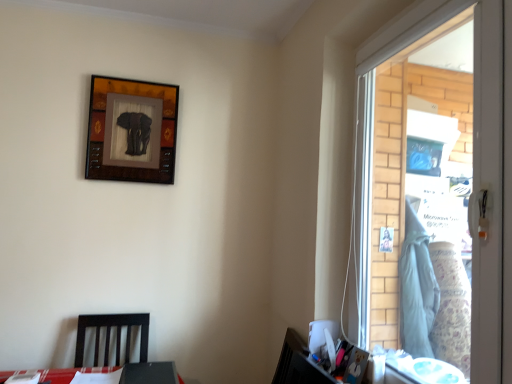
Question: Is dark wood chair at lower left wider than wooden elephant art at upper left?

Choices:
 (A) no
 (B) yes

Answer: (B)

Question: Is dark wood chair at lower left aimed at wooden elephant art at upper left?

Choices:
 (A) yes
 (B) no

Answer: (B)

Question: From the image's perspective, is dark wood chair at lower left on top of wooden elephant art at upper left?

Choices:
 (A) no
 (B) yes

Answer: (A)

Question: Is dark wood chair at lower left turned away from wooden elephant art at upper left?

Choices:
 (A) no
 (B) yes

Answer: (A)

Question: From the image's perspective, is dark wood chair at lower left under wooden elephant art at upper left?

Choices:
 (A) no
 (B) yes

Answer: (B)

Question: From the image's perspective, is dark wood chair at lower left located above or below wooden elephant art at upper left?

Choices:
 (A) above
 (B) below

Answer: (B)

Question: Is dark wood chair at lower left in front of or behind wooden elephant art at upper left in the image?

Choices:
 (A) behind
 (B) front

Answer: (B)

Question: Considering the positions of dark wood chair at lower left and wooden elephant art at upper left in the image, is dark wood chair at lower left bigger or smaller than wooden elephant art at upper left?

Choices:
 (A) big
 (B) small

Answer: (A)

Question: Considering the positions of dark wood chair at lower left and wooden elephant art at upper left in the image, is dark wood chair at lower left wider or thinner than wooden elephant art at upper left?

Choices:
 (A) wide
 (B) thin

Answer: (A)

Question: From a real-world perspective, is dark wood chair at lower left physically located above or below clear glass window at right?

Choices:
 (A) above
 (B) below

Answer: (B)

Question: Based on their sizes in the image, would you say dark wood chair at lower left is bigger or smaller than clear glass window at right?

Choices:
 (A) big
 (B) small

Answer: (B)

Question: Considering the positions of point (101, 326) and point (480, 377), is point (101, 326) closer or farther from the camera than point (480, 377)?

Choices:
 (A) closer
 (B) farther

Answer: (B)

Question: From their relative heights in the image, would you say dark wood chair at lower left is taller or shorter than clear glass window at right?

Choices:
 (A) short
 (B) tall

Answer: (A)

Question: Is clear glass window at right taller or shorter than dark wood chair at lower left?

Choices:
 (A) tall
 (B) short

Answer: (A)

Question: Considering the relative positions of clear glass window at right and dark wood chair at lower left in the image provided, is clear glass window at right to the left or to the right of dark wood chair at lower left?

Choices:
 (A) right
 (B) left

Answer: (A)